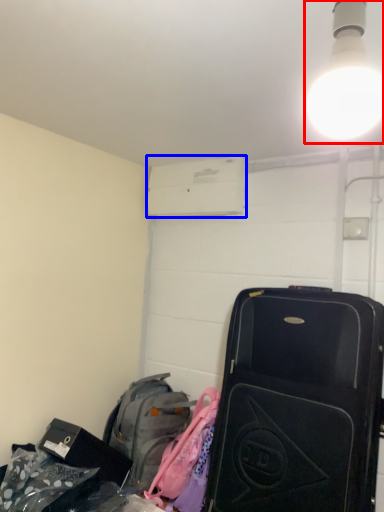
Question: Which point is further to the camera, light fixture (highlighted by a red box) or air conditioning (highlighted by a blue box)?

Choices:
 (A) light fixture
 (B) air conditioning

Answer: (B)